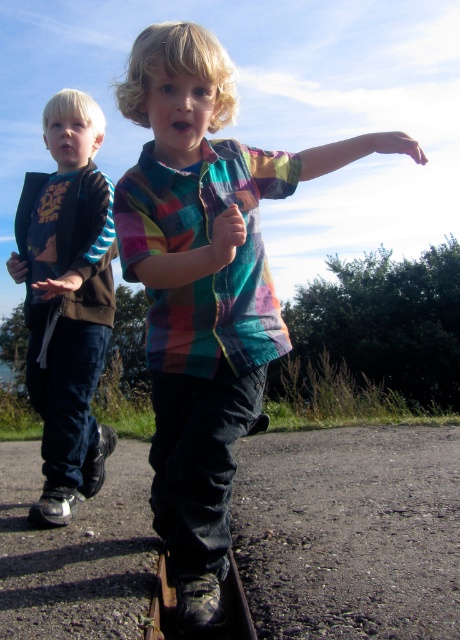
You are a photographer trying to capture both children in a single shot. Since the multicolored plaid shirt at center and the multicolored fabric shirt at center are in different positions, which child should you move closer to the front to ensure both are visible?

You should move the multicolored fabric shirt at center closer to the front because it is currently behind the multicolored plaid shirt at center, making it harder to see both clearly in the photo.

You are a photographer trying to capture a clear photo of the multicolored fabric shirt at center and the matte black hoodie at left. Since you want both subjects in focus, which child should you focus on first?

You should focus on the multicolored fabric shirt at center first because it is in front of the matte black hoodie at left, so focusing on the closer subject will ensure both are in focus.

You are a photographer trying to capture a photo of the two children. You want to ensure that the matte black jacket at left and the multicolored fabric arm at center are both in the frame. Based on their positions, which child should you focus on to include both objects in your shot?

The matte black jacket at left is to the left of the multicolored fabric arm at center, so focusing on the child wearing the matte black jacket at left will ensure both objects are included in the frame.